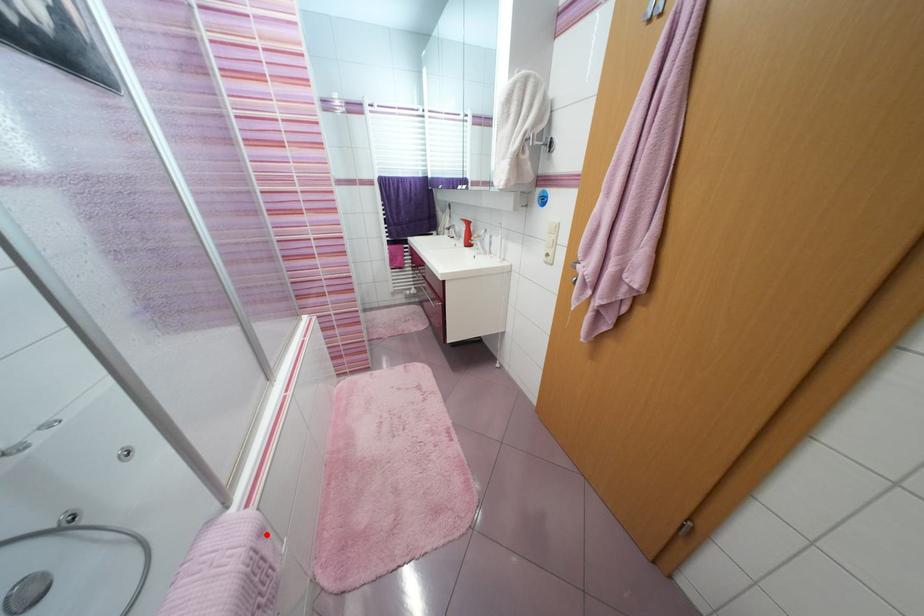
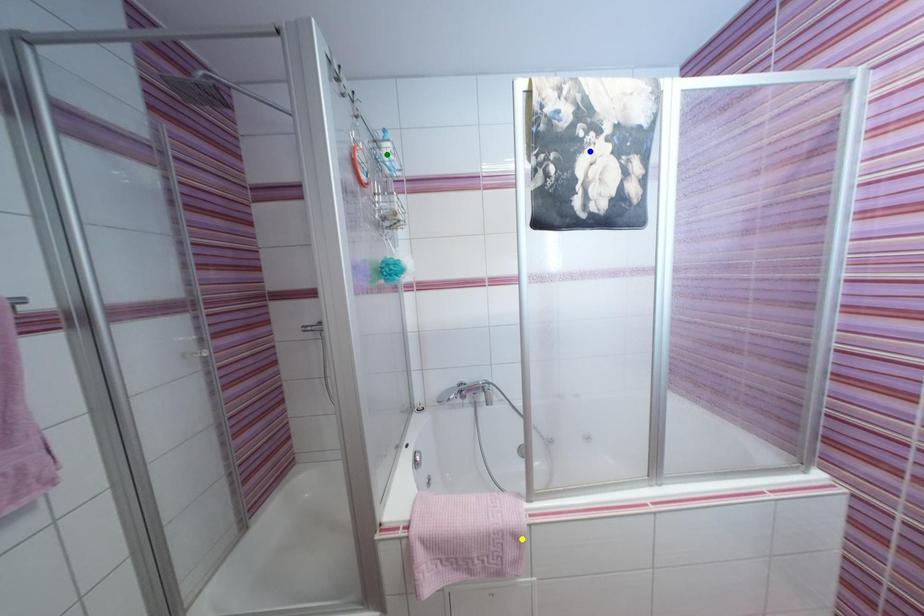
Question: I am providing you with two images of the same scene from different viewpoints. A red point is marked on the first image. You are given multiple points on the second image. Which mark in image 2 goes with the point in image 1?

Choices:
 (A) blue point
 (B) green point
 (C) yellow point

Answer: (C)